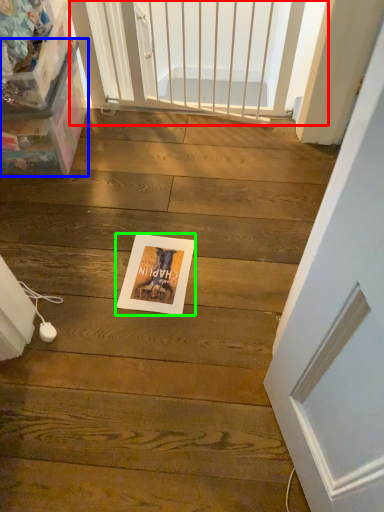
Question: Which object is the closest to the screen door (highlighted by a red box)? Choose among these: box (highlighted by a blue box) or postcard (highlighted by a green box).

Choices:
 (A) box
 (B) postcard

Answer: (A)